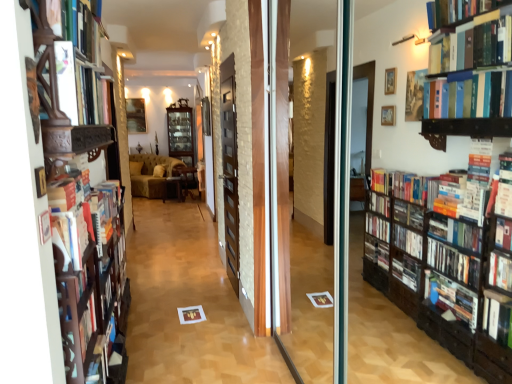
The width and height of the screenshot is (512, 384). I want to click on free space to the left of dark brown wooden screen door at center, so click(173, 284).